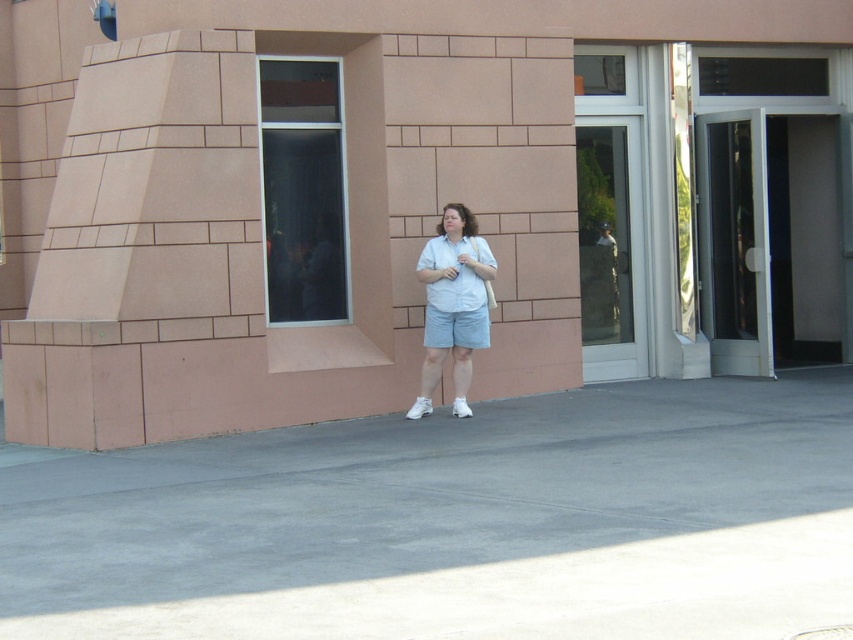
Can you confirm if light blue denim shorts at center is wider than light blue cotton shirt at center?

Indeed, light blue denim shorts at center has a greater width compared to light blue cotton shirt at center.

Who is shorter, light blue denim shorts at center or light blue cotton shirt at center?

With less height is light blue cotton shirt at center.

Is point (459, 348) farther from camera compared to point (450, 268)?

Yes, point (459, 348) is farther from viewer.

Identify the location of light blue denim shorts at center. The image size is (853, 640). (453, 305).

Measure the distance between point (569,540) and camera.

They are 7.03 meters apart.

Is gray concrete pavement at center thinner than light blue cotton shirt at center?

Correct, gray concrete pavement at center's width is less than light blue cotton shirt at center's.

Which is behind, point (260, 508) or point (436, 244)?

Point (436, 244)

The width and height of the screenshot is (853, 640). In order to click on gray concrete pavement at center in this screenshot , I will do `click(454, 524)`.

Does gray concrete pavement at center have a smaller size compared to light blue denim shorts at center?

Indeed, gray concrete pavement at center has a smaller size compared to light blue denim shorts at center.

At what (x,y) coordinates should I click in order to perform the action: click on gray concrete pavement at center. Please return your answer as a coordinate pair (x, y). Looking at the image, I should click on (454, 524).